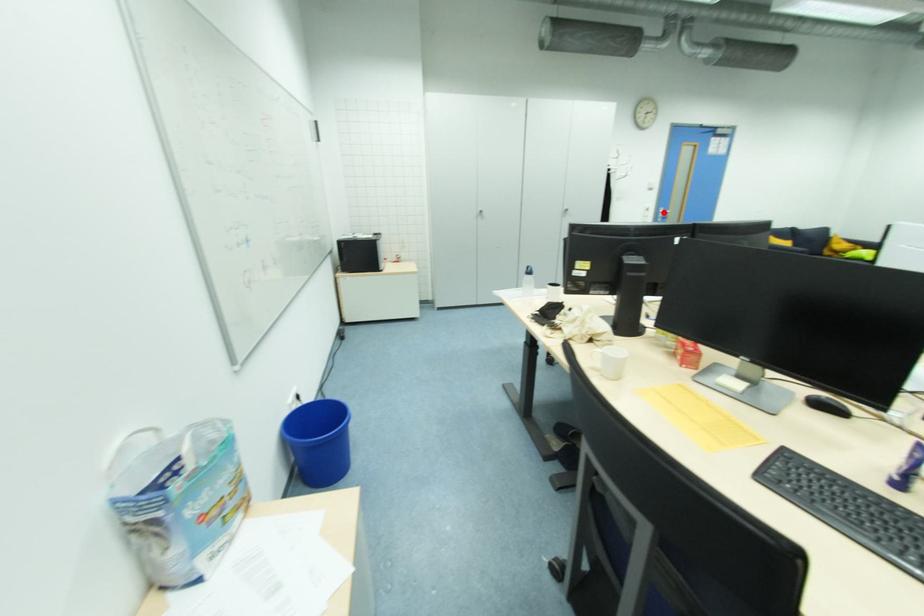
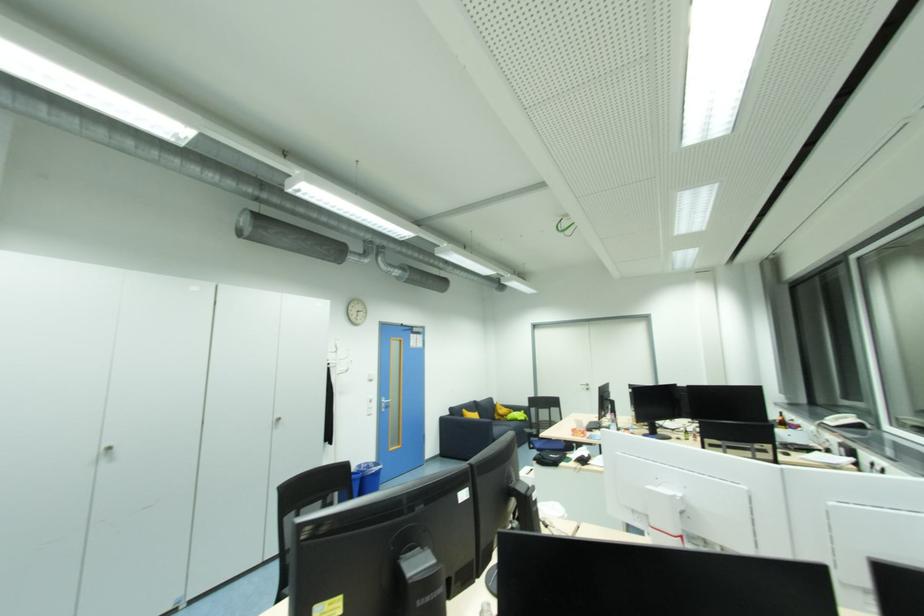
Where in the second image is the point corresponding to the highlighted location from the first image?

(386, 402)